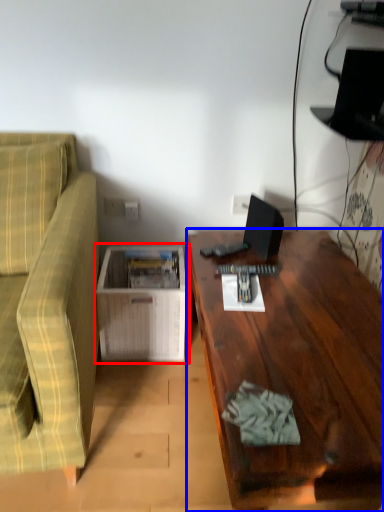
Question: Which point is further to the camera, table (highlighted by a red box) or desk (highlighted by a blue box)?

Choices:
 (A) table
 (B) desk

Answer: (A)